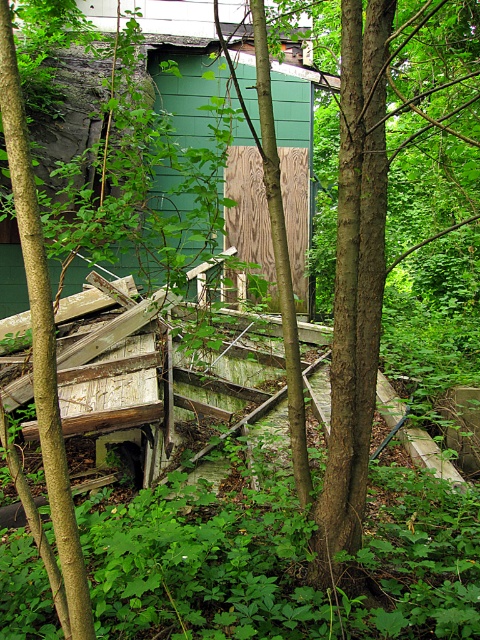
Is point (250, 236) in front of point (294, 164)?

Yes.

Is green wood paneling at center wider than wooden panel at center?

Correct, the width of green wood paneling at center exceeds that of wooden panel at center.

Who is more distant from viewer, (278,76) or (296,161)?

The point (278,76) is more distant.

The height and width of the screenshot is (640, 480). In order to click on green wood paneling at center in this screenshot , I will do `click(295, 161)`.